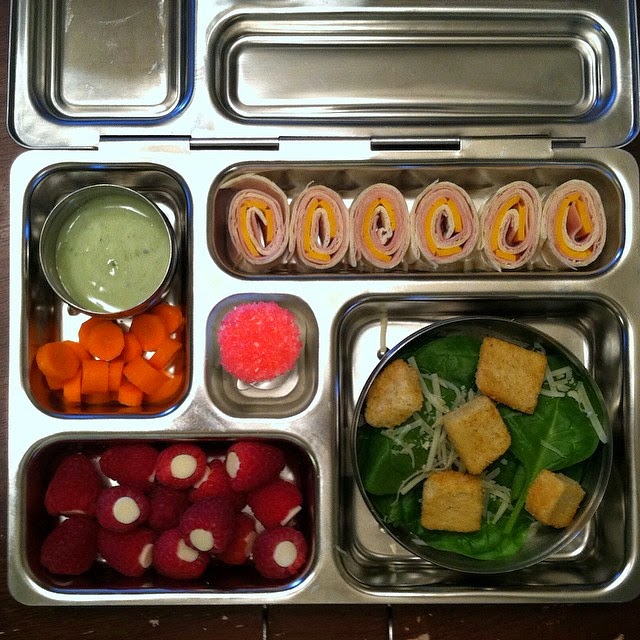
Where is `tray lid`? This screenshot has width=640, height=640. tray lid is located at coordinates (300, 64).